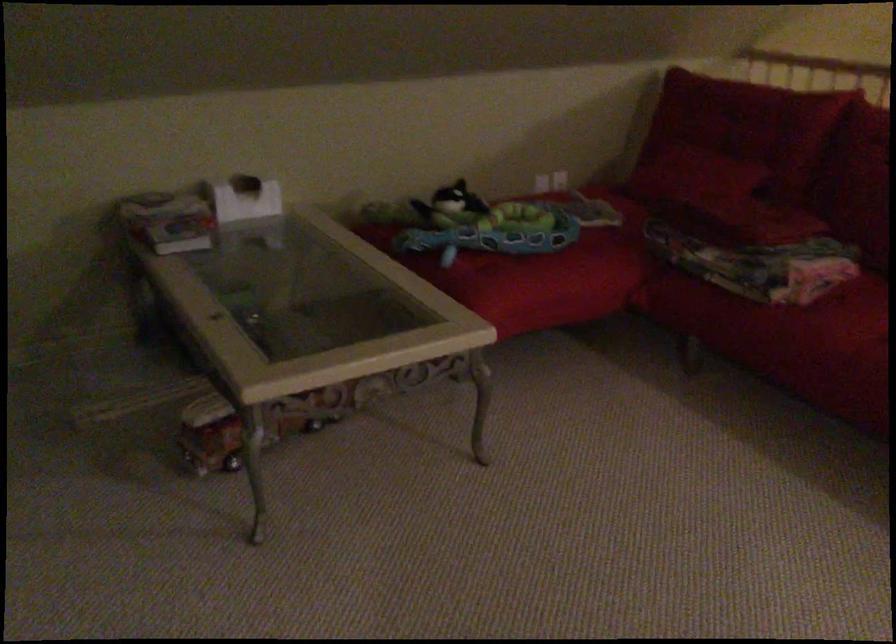
Identify the location of sofa sitting surface. (843, 317).